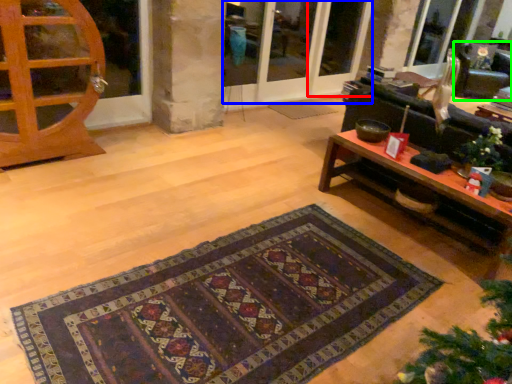
Question: Which object is the closest to the screen door (highlighted by a red box)? Choose among these: screen door (highlighted by a blue box) or armchair (highlighted by a green box).

Choices:
 (A) screen door
 (B) armchair

Answer: (A)